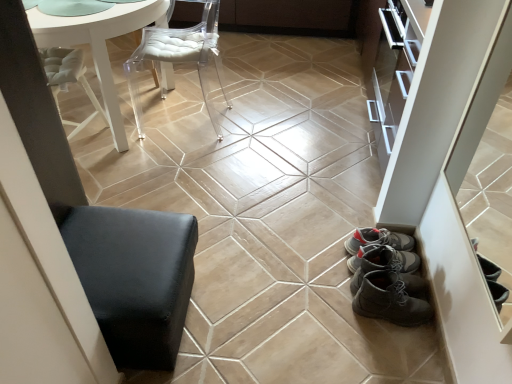
Question: In terms of size, does matte brown cabinet at upper center appear bigger or smaller than transparent acrylic chair at upper center?

Choices:
 (A) small
 (B) big

Answer: (B)

Question: Is matte brown cabinet at upper center in front of or behind transparent acrylic chair at upper center in the image?

Choices:
 (A) front
 (B) behind

Answer: (B)

Question: Which object is the farthest from the white glossy table at upper left?

Choices:
 (A) beige glossy ceramic tile at center
 (B) black leather ottoman at lower left
 (C) matte brown cabinet at upper center
 (D) transparent acrylic chair at upper center

Answer: (C)

Question: Which object is the closest to the matte brown cabinet at upper center?

Choices:
 (A) white glossy table at upper left
 (B) beige glossy ceramic tile at center
 (C) black leather ottoman at lower left
 (D) transparent acrylic chair at upper center

Answer: (D)